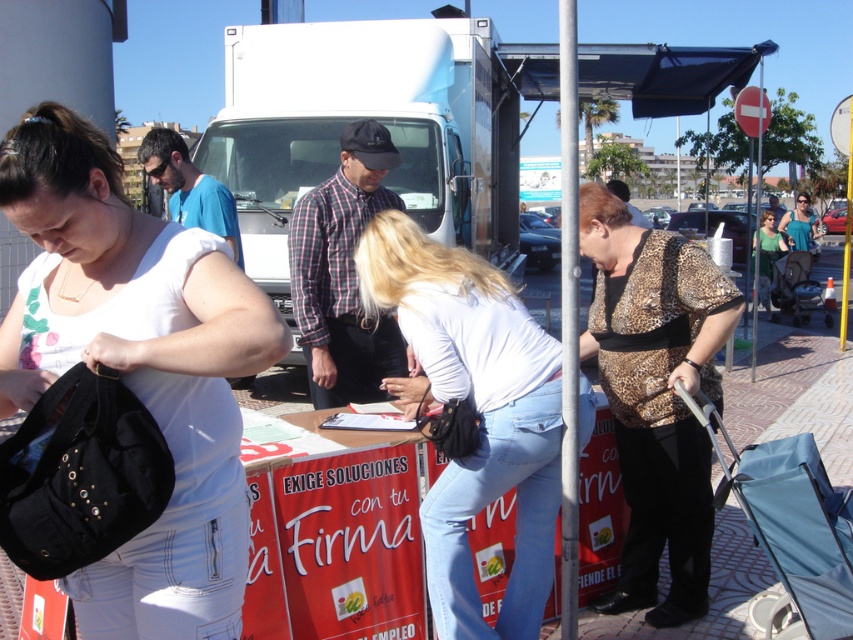
Question: Which object appears farthest from the camera in this image?

Choices:
 (A) black leather bag at left
 (B) blue fabric stroller at lower right
 (C) green jersey at center
 (D) matte black purse at center

Answer: (C)

Question: Is matte black purse at center positioned in front of blue fabric stroller at lower right?

Choices:
 (A) no
 (B) yes

Answer: (B)

Question: Is black leather bag at left thinner than plaid fabric shirt at center?

Choices:
 (A) no
 (B) yes

Answer: (A)

Question: Can you confirm if blue fabric stroller at lower right is positioned below green jersey at center?

Choices:
 (A) no
 (B) yes

Answer: (B)

Question: Which of the following is the farthest from the observer?

Choices:
 (A) (379, 209)
 (B) (706, 396)
 (C) (334, 129)

Answer: (C)

Question: Among these points, which one is nearest to the camera?

Choices:
 (A) (776, 257)
 (B) (250, 65)

Answer: (B)